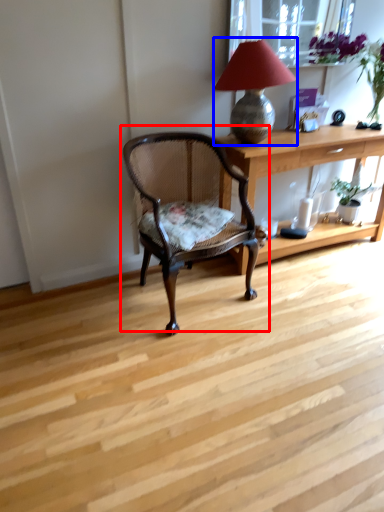
Question: Which of the following is the closest to the observer, chair (highlighted by a red box) or lamp (highlighted by a blue box)?

Choices:
 (A) chair
 (B) lamp

Answer: (A)